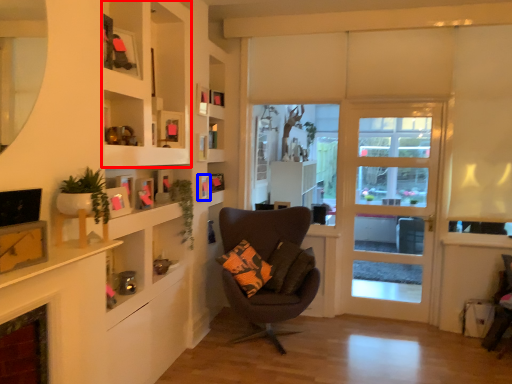
Question: Which of the following is the closest to the observer, cabinet (highlighted by a red box) or picture frame (highlighted by a blue box)?

Choices:
 (A) cabinet
 (B) picture frame

Answer: (A)